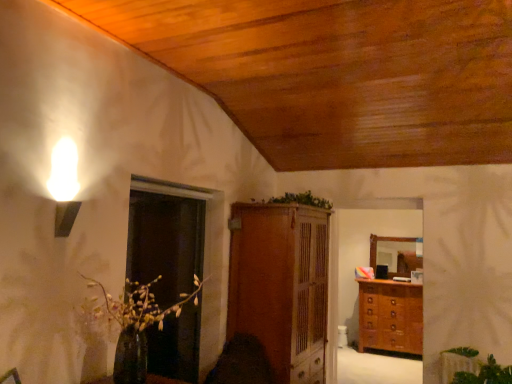
Describe the element at coordinates (281, 286) in the screenshot. I see `wooden cabinet at center` at that location.

What do you see at coordinates (300, 200) in the screenshot? I see `green leafy plant at center, which appears as the 1th plant when viewed from the top` at bounding box center [300, 200].

Image resolution: width=512 pixels, height=384 pixels. Describe the element at coordinates (390, 316) in the screenshot. I see `wooden chest of drawers at right` at that location.

This screenshot has height=384, width=512. Describe the element at coordinates (165, 243) in the screenshot. I see `transparent glass door at center` at that location.

You are a GUI agent. You are given a task and a screenshot of the screen. Output one action in this format:
    pyautogui.click(x=<x>, y=<y>)
    Task: Click on the wooden cabinet at center
    
    Given the screenshot: What is the action you would take?
    pyautogui.click(x=281, y=286)

Is transparent glass door at center a part of green leafy plant at center, acting as the first plant starting from the back?

Definitely not — transparent glass door at center is not inside green leafy plant at center, acting as the first plant starting from the back.

Which of these two, green leafy plant at center, which appears as the 1th plant when viewed from the top, or transparent glass door at center, stands taller?

With more height is transparent glass door at center.

What's the angular difference between green leafy plant at center, arranged as the 2th plant when viewed from the right, and transparent glass door at center's facing directions?

The angle between the facing direction of green leafy plant at center, arranged as the 2th plant when viewed from the right, and the facing direction of transparent glass door at center is 0.971 degrees.

Locate an element on the screen. plant above the transparent glass door at center (from a real-world perspective) is located at coordinates (300, 200).

Could you tell me if green leafy plant at center, which appears as the 1th plant when viewed from the top, is turned towards wooden chest of drawers at right?

No, green leafy plant at center, which appears as the 1th plant when viewed from the top, does not turn towards wooden chest of drawers at right.

From a real-world perspective, between green leafy plant at center, acting as the first plant starting from the back, and wooden chest of drawers at right, who is vertically higher?

From a 3D spatial view, green leafy plant at center, acting as the first plant starting from the back, is above.

Image resolution: width=512 pixels, height=384 pixels. In the image, there is a green leafy plant at center, acting as the first plant starting from the back. Identify the location of the chest of drawers below it (from a real-world perspective). (390, 316).

Are green leafy plant at center, arranged as the 2th plant when viewed from the right, and wooden chest of drawers at right beside each other?

No, green leafy plant at center, arranged as the 2th plant when viewed from the right, is not touching wooden chest of drawers at right.

Is wooden cabinet at center inside or outside of green leafy plant at lower right, the 1th plant when ordered from right to left?

wooden cabinet at center is outside green leafy plant at lower right, the 1th plant when ordered from right to left.

Consider the image. Considering the relative positions of wooden cabinet at center and green leafy plant at lower right, placed as the 1th plant when sorted from front to back, in the image provided, is wooden cabinet at center to the left of green leafy plant at lower right, placed as the 1th plant when sorted from front to back, from the viewer's perspective?

Indeed, wooden cabinet at center is positioned on the left side of green leafy plant at lower right, placed as the 1th plant when sorted from front to back.

How different are the orientations of wooden cabinet at center and green leafy plant at lower right, the first plant when ordered from bottom to top, in degrees?

The angular difference between wooden cabinet at center and green leafy plant at lower right, the first plant when ordered from bottom to top, is 89.1 degrees.

Measure the distance from wooden cabinet at center to green leafy plant at lower right, the 2th plant positioned from the top.

wooden cabinet at center and green leafy plant at lower right, the 2th plant positioned from the top, are 5.03 feet apart.

From a real-world perspective, is wooden chest of drawers at right above or below wooden cabinet at center?

wooden chest of drawers at right is situated lower than wooden cabinet at center in the real world.

In the image, there is a wooden chest of drawers at right. Where is `cupboard above it (from the image's perspective)`? The height and width of the screenshot is (384, 512). cupboard above it (from the image's perspective) is located at coordinates (281, 286).

Which is farther, (410, 300) or (292, 217)?

The point (410, 300) is more distant.

Measure the distance from green leafy plant at center, arranged as the 2th plant when viewed from the right, to wooden cabinet at center.

green leafy plant at center, arranged as the 2th plant when viewed from the right, is 26.52 inches from wooden cabinet at center.

Is point (291, 201) closer or farther from the camera than point (303, 274)?

Point (291, 201) is positioned closer to the camera compared to point (303, 274).

Relative to wooden cabinet at center, is green leafy plant at center, which is counted as the second plant, starting from the front, in front or behind?

Clearly, green leafy plant at center, which is counted as the second plant, starting from the front, is behind wooden cabinet at center.

Where is `cupboard below the green leafy plant at center, the first plant when ordered from left to right (from the image's perspective)`? The height and width of the screenshot is (384, 512). cupboard below the green leafy plant at center, the first plant when ordered from left to right (from the image's perspective) is located at coordinates 281,286.

Identify the location of plant above the green leafy plant at lower right, placed as the 1th plant when sorted from front to back (from the image's perspective). (300, 200).

Consider the image. Between green leafy plant at center, which appears as the 1th plant when viewed from the top, and green leafy plant at lower right, the 2th plant positioned from the top, which one has smaller width?

Thinner between the two is green leafy plant at center, which appears as the 1th plant when viewed from the top.

Based on the photo, is green leafy plant at center, which appears as the second plant when ordered from the bottom, touching green leafy plant at lower right, which is the second plant in left-to-right order?

green leafy plant at center, which appears as the second plant when ordered from the bottom, and green leafy plant at lower right, which is the second plant in left-to-right order, are not in contact.

Which of these two, green leafy plant at lower right, the first plant when ordered from bottom to top, or wooden cabinet at center, is thinner?

wooden cabinet at center.

From a real-world perspective, is green leafy plant at lower right, placed as the 1th plant when sorted from front to back, located beneath wooden cabinet at center?

Yes.

Is green leafy plant at lower right, the 1th plant when ordered from right to left, located outside wooden cabinet at center?

That's correct, green leafy plant at lower right, the 1th plant when ordered from right to left, is outside of wooden cabinet at center.

I want to click on plant that appears above the transparent glass door at center (from a real-world perspective), so click(x=300, y=200).

Where is `chest of drawers below the green leafy plant at center, which appears as the 1th plant when viewed from the top (from a real-world perspective)`? chest of drawers below the green leafy plant at center, which appears as the 1th plant when viewed from the top (from a real-world perspective) is located at coordinates (390, 316).

Estimate the real-world distances between objects in this image. Which object is further from wooden cabinet at center, green leafy plant at center, which appears as the 1th plant when viewed from the top, or transparent glass door at center?

transparent glass door at center.

Considering their positions, is wooden cabinet at center positioned closer to wooden chest of drawers at right than green leafy plant at lower right, the 1th plant when ordered from right to left?

green leafy plant at lower right, the 1th plant when ordered from right to left.

Based on their spatial positions, is wooden cabinet at center or green leafy plant at center, acting as the first plant starting from the back, further from wooden chest of drawers at right?

green leafy plant at center, acting as the first plant starting from the back, is positioned further to the anchor wooden chest of drawers at right.

Which object lies nearer to the anchor point wooden chest of drawers at right, green leafy plant at center, which appears as the 1th plant when viewed from the top, or transparent glass door at center?

green leafy plant at center, which appears as the 1th plant when viewed from the top, is closer to wooden chest of drawers at right.

When comparing their distances from green leafy plant at lower right, marked as the 2th plant in a back-to-front arrangement, does wooden cabinet at center or wooden chest of drawers at right seem closer?

wooden chest of drawers at right is positioned closer to the anchor green leafy plant at lower right, marked as the 2th plant in a back-to-front arrangement.

From the picture: Which object lies further to the anchor point green leafy plant at lower right, the first plant when ordered from bottom to top, wooden chest of drawers at right or green leafy plant at center, arranged as the 2th plant when viewed from the right?

green leafy plant at center, arranged as the 2th plant when viewed from the right, is positioned further to the anchor green leafy plant at lower right, the first plant when ordered from bottom to top.

Which object lies nearer to the anchor point transparent glass door at center, wooden chest of drawers at right or wooden cabinet at center?

wooden cabinet at center is positioned closer to the anchor transparent glass door at center.

When comparing their distances from wooden chest of drawers at right, does transparent glass door at center or green leafy plant at lower right, the 2th plant positioned from the top, seem further?

transparent glass door at center is further to wooden chest of drawers at right.

You are a GUI agent. You are given a task and a screenshot of the screen. Output one action in this format:
    pyautogui.click(x=<x>, y=<y>)
    Task: Click on the plant located between transparent glass door at center and wooden chest of drawers at right in the depth direction
    The image size is (512, 384).
    Given the screenshot: What is the action you would take?
    point(300,200)

Image resolution: width=512 pixels, height=384 pixels. I want to click on plant between wooden cabinet at center and green leafy plant at lower right, the 1th plant when ordered from right to left, so click(300, 200).

Locate an element on the screen. This screenshot has height=384, width=512. cupboard between transparent glass door at center and wooden chest of drawers at right from front to back is located at coordinates click(x=281, y=286).

Identify the location of glass door positioned between green leafy plant at lower right, which is the second plant in left-to-right order, and wooden chest of drawers at right from near to far. (165, 243).